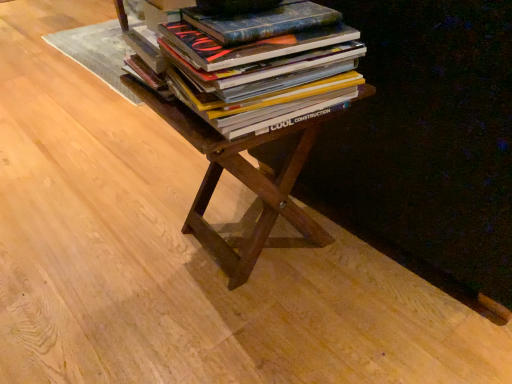
Question: Would you say hardcover books at center is inside or outside brown wood table at center?

Choices:
 (A) inside
 (B) outside

Answer: (B)

Question: In the image, is hardcover books at center positioned in front of or behind brown wood table at center?

Choices:
 (A) behind
 (B) front

Answer: (B)

Question: Is hardcover books at center taller or shorter than brown wood table at center?

Choices:
 (A) short
 (B) tall

Answer: (A)

Question: Visually, is brown wood table at center positioned to the left or to the right of hardcover books at center?

Choices:
 (A) right
 (B) left

Answer: (B)

Question: Is brown wood table at center bigger or smaller than hardcover books at center?

Choices:
 (A) big
 (B) small

Answer: (A)

Question: Is brown wood table at center taller or shorter than hardcover books at center?

Choices:
 (A) short
 (B) tall

Answer: (B)

Question: From a real-world perspective, relative to hardcover books at center, is brown wood table at center vertically above or below?

Choices:
 (A) above
 (B) below

Answer: (B)